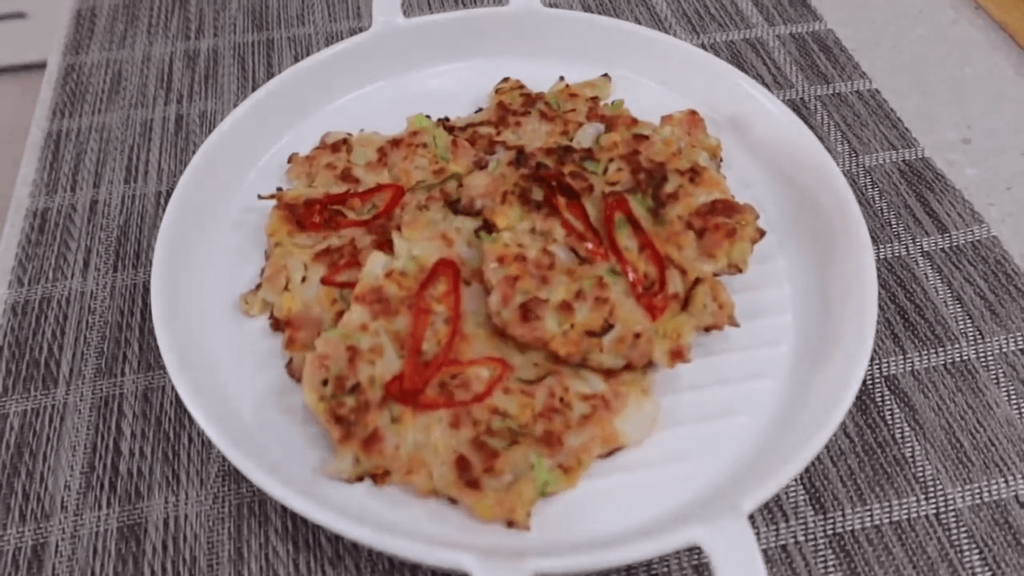
You are a GUI agent. You are given a task and a screenshot of the screen. Output one action in this format:
    pyautogui.click(x=<x>, y=<y>)
    Task: Click on the handles
    This screenshot has height=576, width=1024.
    Given the screenshot: What is the action you would take?
    pyautogui.click(x=729, y=540), pyautogui.click(x=382, y=12), pyautogui.click(x=515, y=3)